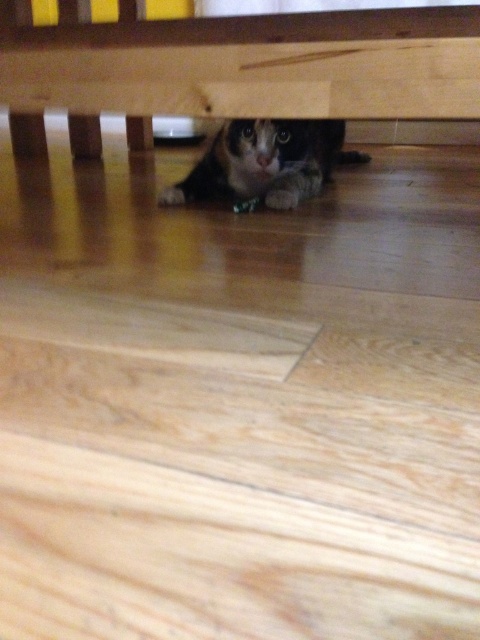
Question: Among these points, which one is nearest to the camera?

Choices:
 (A) (75, 76)
 (B) (212, 173)

Answer: (A)

Question: Which point is farther to the camera?

Choices:
 (A) wooden table at lower center
 (B) calico fur cat at center

Answer: (B)

Question: Considering the relative positions of wooden table at lower center and calico fur cat at center in the image provided, where is wooden table at lower center located with respect to calico fur cat at center?

Choices:
 (A) left
 (B) right

Answer: (A)

Question: Is wooden table at lower center to the right of calico fur cat at center from the viewer's perspective?

Choices:
 (A) no
 (B) yes

Answer: (A)

Question: Is wooden table at lower center positioned in front of calico fur cat at center?

Choices:
 (A) no
 (B) yes

Answer: (B)